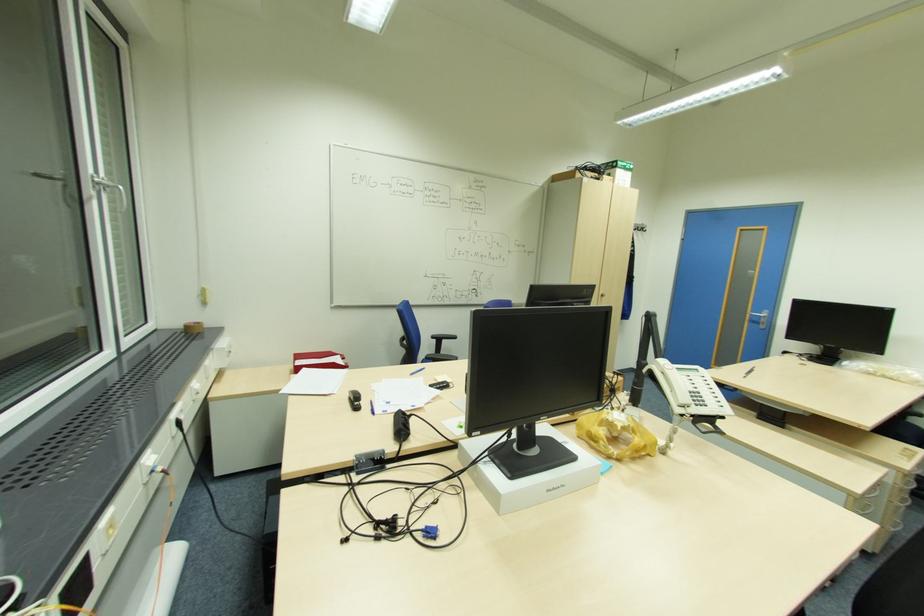
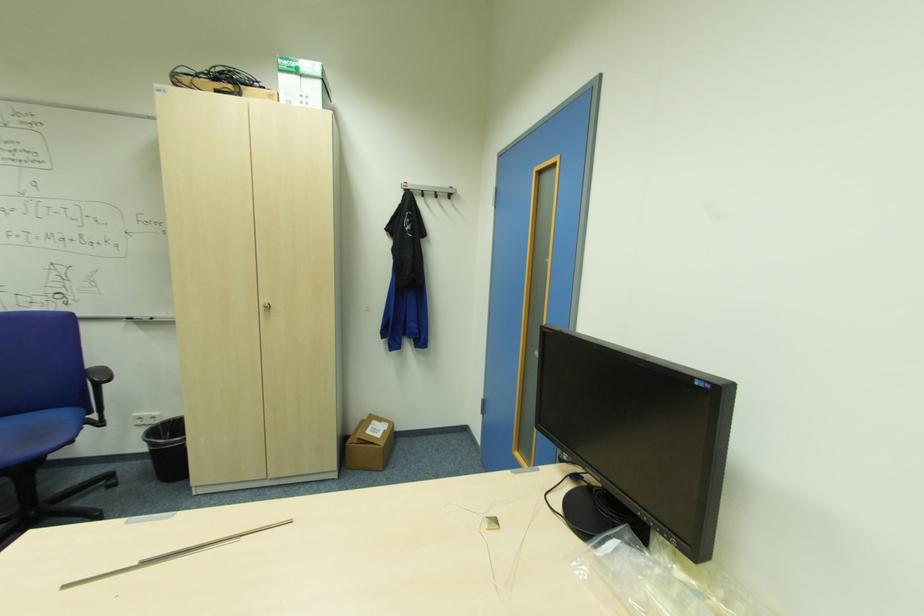
The point at (604,294) is marked in the first image. Where is the corresponding point in the second image?

(271, 307)